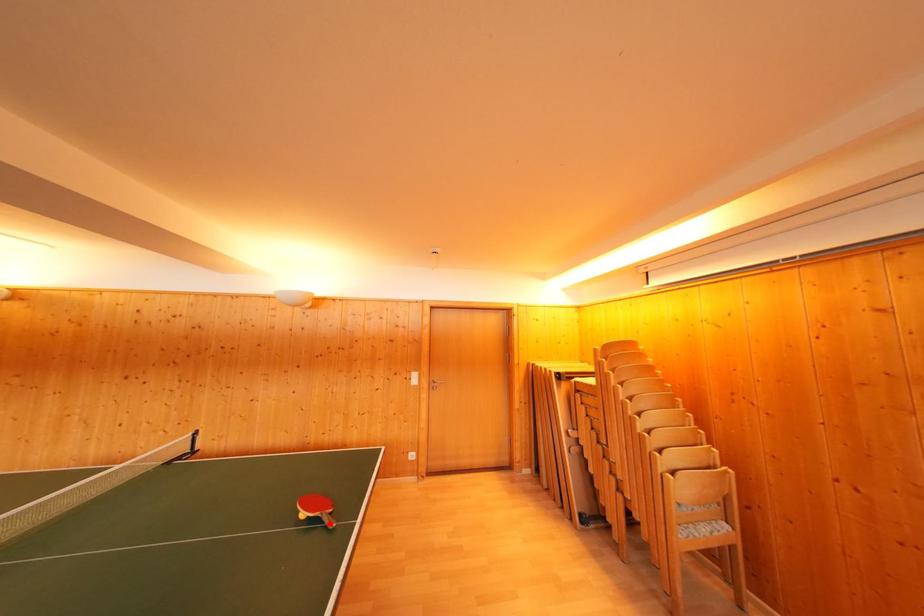
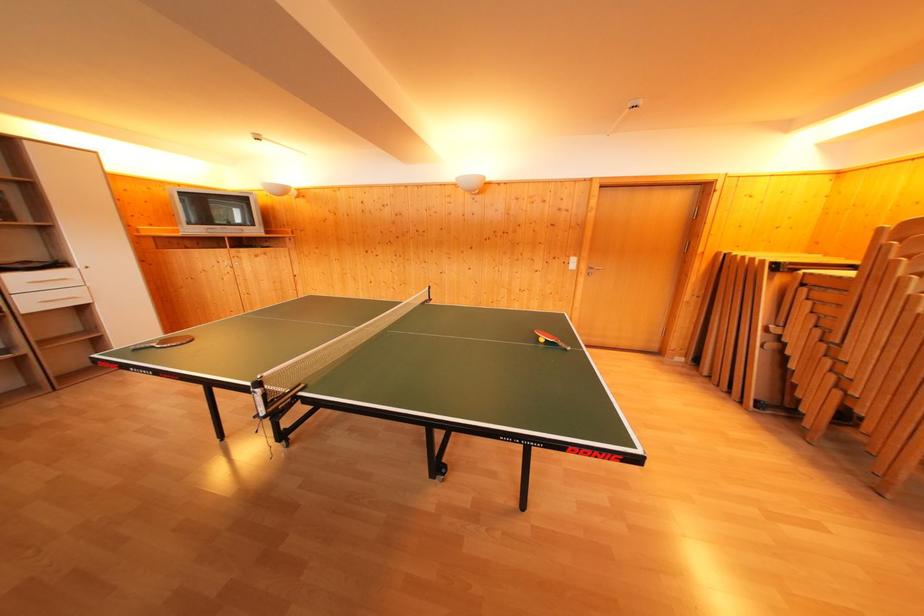
Question: I am providing you with two images of the same scene from different viewpoints. A red point is shown in image1. For the corresponding object point in image2, is it positioned nearer or farther from the camera?

Choices:
 (A) Nearer
 (B) Farther

Answer: (B)